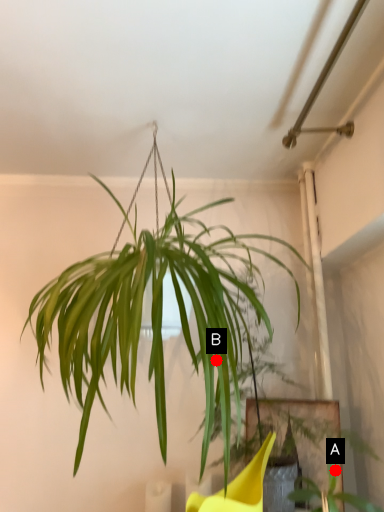
Question: Two points are circled on the image, labeled by A and B beside each circle. Which point is farther to the camera?

Choices:
 (A) A is further
 (B) B is further

Answer: (A)